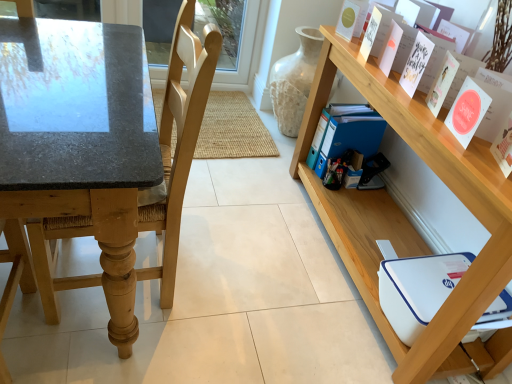
You are a GUI agent. You are given a task and a screenshot of the screen. Output one action in this format:
    pyautogui.click(x=<x>, y=<y>)
    Task: Click on the spots to the right of light wood chair at left
    The width and height of the screenshot is (512, 384).
    Given the screenshot: What is the action you would take?
    pyautogui.click(x=231, y=287)